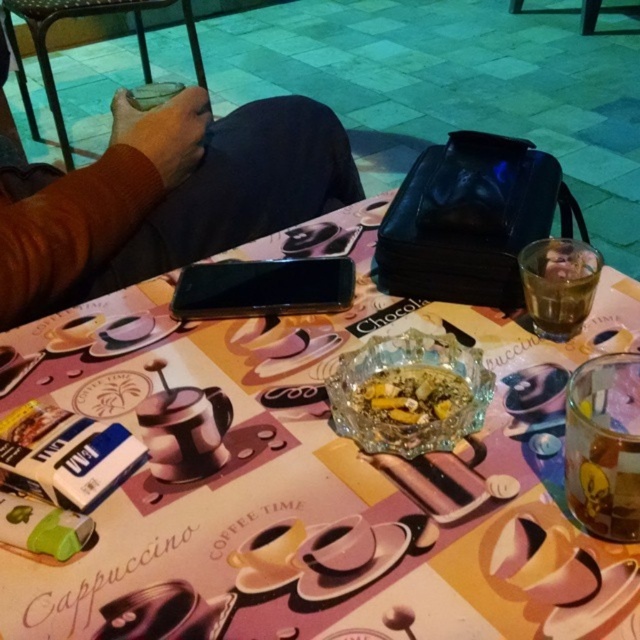
Does brown leather jacket at upper left appear on the left side of translucent glass bowl at center?

Indeed, brown leather jacket at upper left is positioned on the left side of translucent glass bowl at center.

Describe the element at coordinates (164, 196) in the screenshot. The width and height of the screenshot is (640, 640). I see `brown leather jacket at upper left` at that location.

Does point (148, 132) come in front of point (445, 400)?

No, it is behind (445, 400).

Identify the location of brown leather jacket at upper left. This screenshot has width=640, height=640. (164, 196).

Is matte plastic phone at upper center smaller than translucent glass bowl at center?

No.

Is the position of matte plastic phone at upper center less distant than that of translucent glass bowl at center?

No, matte plastic phone at upper center is behind translucent glass bowl at center.

Between point (156, 0) and point (387, 406), which one is positioned in front?

Point (387, 406)

Locate an element on the screen. The height and width of the screenshot is (640, 640). matte plastic phone at upper center is located at coordinates (48, 54).

Is translucent glass cup at lower right below translucent glass bowl at center?

Indeed, translucent glass cup at lower right is positioned under translucent glass bowl at center.

Who is shorter, translucent glass cup at lower right or translucent glass bowl at center?

translucent glass bowl at center

The image size is (640, 640). What do you see at coordinates (600, 472) in the screenshot?
I see `translucent glass cup at lower right` at bounding box center [600, 472].

Find the location of `translucent glass cup at lower right`. translucent glass cup at lower right is located at coordinates (600, 472).